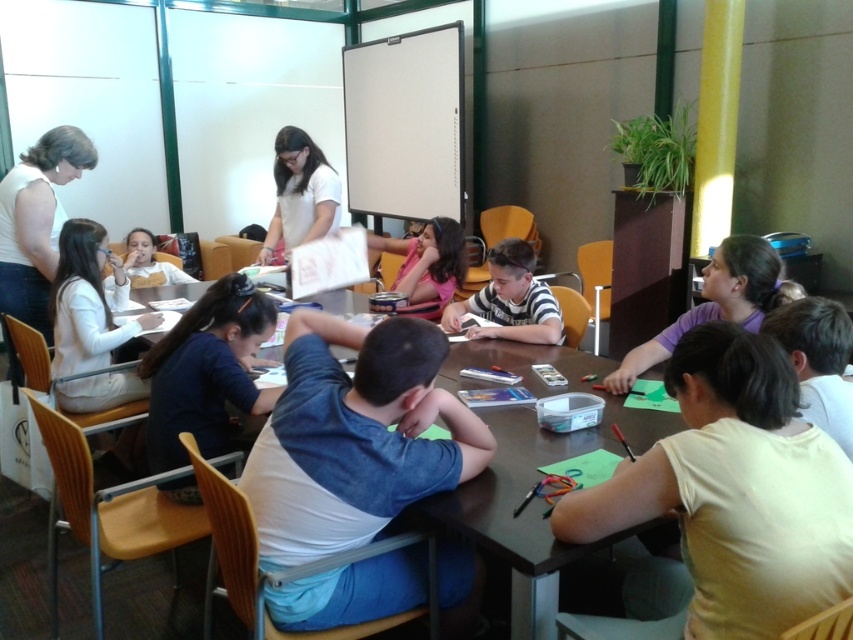
Can you confirm if brown wooden table at center is shorter than white sleeveless top at upper left?

Yes, brown wooden table at center is shorter than white sleeveless top at upper left.

Looking at this image, who is more forward, (241, 417) or (91, 144)?

Point (241, 417) is in front.

Locate an element on the screen. This screenshot has height=640, width=853. brown wooden table at center is located at coordinates point(193,429).

Between blue denim shirt at center and brown wooden table at center, which one has more height?

brown wooden table at center is taller.

Where is `blue denim shirt at center`? blue denim shirt at center is located at coordinates (355, 436).

Can you confirm if blue denim shirt at center is bigger than white sleeveless top at upper left?

Correct, blue denim shirt at center is larger in size than white sleeveless top at upper left.

Which of these two, blue denim shirt at center or white sleeveless top at upper left, stands shorter?

blue denim shirt at center is shorter.

Does point (300, 460) lie in front of point (1, 227)?

Yes, point (300, 460) is closer to viewer.

Locate an element on the screen. Image resolution: width=853 pixels, height=640 pixels. blue denim shirt at center is located at coordinates (355, 436).